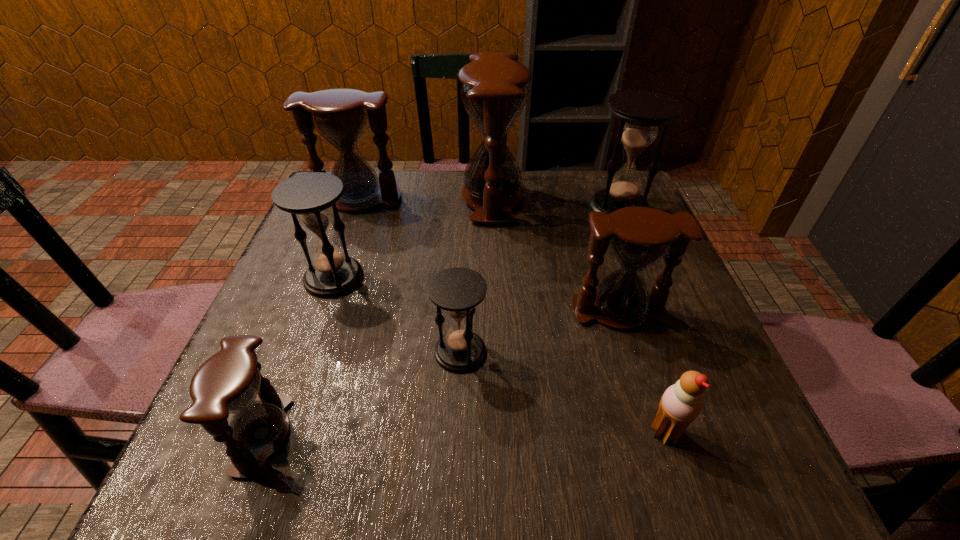
Locate an element on the screen. The image size is (960, 540). the smallest black hourglass is located at coordinates (457, 291).

Where is `the nearest brown hourglass`? The height and width of the screenshot is (540, 960). the nearest brown hourglass is located at coordinates (228, 382).

This screenshot has height=540, width=960. I want to click on the nearest hourglass, so click(228, 382).

Identify the location of icecream. (681, 403).

The height and width of the screenshot is (540, 960). What are the coordinates of `vacant space situated on the left of the third brown hourglass from left to right` in the screenshot? It's located at (348, 197).

Locate an element on the screen. The height and width of the screenshot is (540, 960). vacant region located 0.230m on the left of the rightmost black hourglass is located at coordinates (498, 208).

Image resolution: width=960 pixels, height=540 pixels. In order to click on vacant area situated on the right of the second biggest brown hourglass in this screenshot , I will do `click(542, 200)`.

Locate an element on the screen. The image size is (960, 540). vacant region located 0.300m on the right of the second farthest black hourglass is located at coordinates (505, 278).

At what (x,y) coordinates should I click in order to perform the action: click on vacant space located 0.050m on the left of the rightmost brown hourglass. Please return your answer as a coordinate pair (x, y). The width and height of the screenshot is (960, 540). Looking at the image, I should click on (547, 311).

Where is `vacant region located on the left of the smallest black hourglass`? The width and height of the screenshot is (960, 540). vacant region located on the left of the smallest black hourglass is located at coordinates (324, 352).